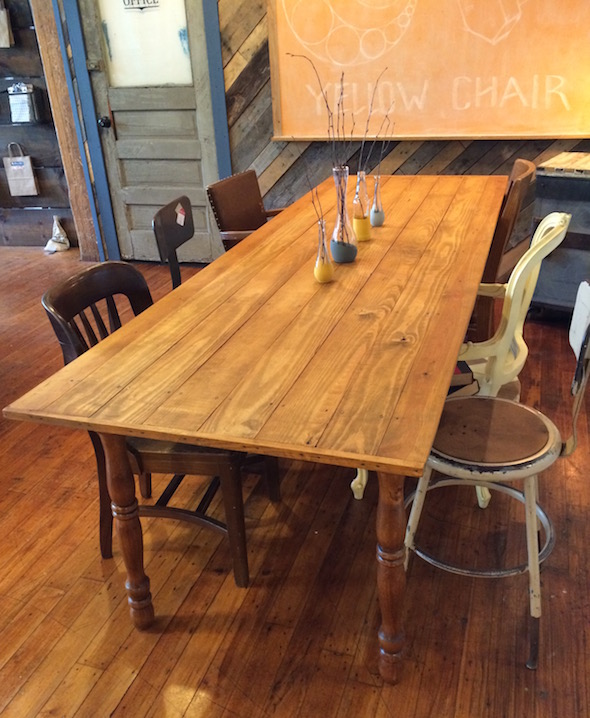
Find the location of `4 bunches of sticks in the centerpiece`. 4 bunches of sticks in the centerpiece is located at coordinates (381, 144), (339, 148), (362, 146), (319, 208).